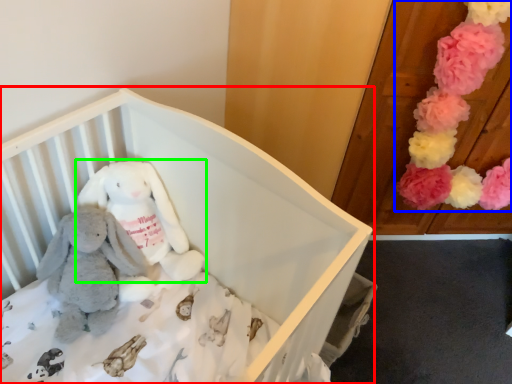
Question: Based on their relative distances, which object is farther from infant bed (highlighted by a red box)? Choose from toy (highlighted by a blue box) and toy (highlighted by a green box).

Choices:
 (A) toy
 (B) toy

Answer: (A)